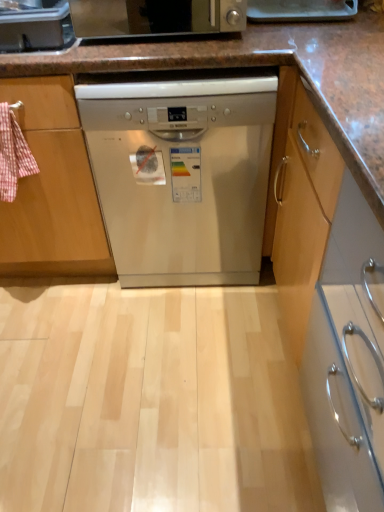
Image resolution: width=384 pixels, height=512 pixels. Find the location of `satin silver dishwasher at center`. satin silver dishwasher at center is located at coordinates (182, 176).

Is satin silver toaster at upper center to the left or to the right of satin silver toaster at upper left in the image?

Clearly, satin silver toaster at upper center is on the right of satin silver toaster at upper left in the image.

You are a GUI agent. You are given a task and a screenshot of the screen. Output one action in this format:
    pyautogui.click(x=<x>, y=<y>)
    Task: Click on the home appliance positioned vertically above the satin silver toaster at upper left (from a real-world perspective)
    
    Given the screenshot: What is the action you would take?
    pyautogui.click(x=155, y=17)

From the image's perspective, which is below, satin silver toaster at upper center or satin silver toaster at upper left?

satin silver toaster at upper left, from the image's perspective.

Is satin silver toaster at upper left bigger than satin silver dishwasher at center?

No, satin silver toaster at upper left is not bigger than satin silver dishwasher at center.

Is satin silver dishwasher at center a part of satin silver toaster at upper left?

No, satin silver toaster at upper left does not contain satin silver dishwasher at center.

Based on the photo, is satin silver toaster at upper left thinner than satin silver dishwasher at center?

Yes.

Between point (27, 40) and point (252, 83), which one is positioned behind?

The point (27, 40) is farther.

Is the depth of satin silver toaster at upper left greater than that of satin silver toaster at upper center?

Yes, satin silver toaster at upper left is further from the viewer.

This screenshot has height=512, width=384. In order to click on home appliance on the right of satin silver toaster at upper left in this screenshot , I will do `click(155, 17)`.

Does satin silver toaster at upper left have a larger size compared to satin silver toaster at upper center?

No, satin silver toaster at upper left is not bigger than satin silver toaster at upper center.

Is satin silver toaster at upper left far from satin silver toaster at upper center?

satin silver toaster at upper left is actually quite close to satin silver toaster at upper center.

Can we say satin silver dishwasher at center lies outside satin silver toaster at upper left?

Yes.

Consider the image. From a real-world perspective, which object stands above the other?

satin silver toaster at upper left, from a real-world perspective.

Which is closer, (134, 32) or (268, 147)?

Point (134, 32).

The height and width of the screenshot is (512, 384). I want to click on dishwasher on the right side of satin silver toaster at upper center, so click(182, 176).

Is satin silver toaster at upper center in front of or behind satin silver dishwasher at center in the image?

satin silver toaster at upper center is in front of satin silver dishwasher at center.

Is point (87, 140) behind point (191, 4)?

Yes, it is.

Is satin silver dishwasher at center aimed at satin silver toaster at upper center?

No.

I want to click on home appliance positioned vertically above the satin silver dishwasher at center (from a real-world perspective), so click(x=155, y=17).

Identify the location of kitchen appliance that is below the satin silver toaster at upper center (from the image's perspective). (35, 25).

The width and height of the screenshot is (384, 512). What are the coordinates of `kitchen appliance above the satin silver dishwasher at center (from a real-world perspective)` in the screenshot? It's located at (35, 25).

Which object lies nearer to the anchor point satin silver toaster at upper center, satin silver toaster at upper left or satin silver dishwasher at center?

satin silver toaster at upper left.

From the image, which object appears to be nearer to satin silver toaster at upper left, satin silver toaster at upper center or satin silver dishwasher at center?

satin silver toaster at upper center.

From the image, which object appears to be farther from satin silver toaster at upper center, satin silver dishwasher at center or satin silver toaster at upper left?

Based on the image, satin silver dishwasher at center appears to be further to satin silver toaster at upper center.

Based on their spatial positions, is satin silver dishwasher at center or satin silver toaster at upper center closer to satin silver toaster at upper left?

satin silver toaster at upper center is closer to satin silver toaster at upper left.

When comparing their distances from satin silver dishwasher at center, does satin silver toaster at upper center or satin silver toaster at upper left seem closer?

The object closer to satin silver dishwasher at center is satin silver toaster at upper center.

Considering their positions, is satin silver toaster at upper left positioned closer to satin silver dishwasher at center than satin silver toaster at upper center?

Among the two, satin silver toaster at upper center is located nearer to satin silver dishwasher at center.

The image size is (384, 512). In order to click on home appliance situated between satin silver toaster at upper left and satin silver dishwasher at center from left to right in this screenshot , I will do `click(155, 17)`.